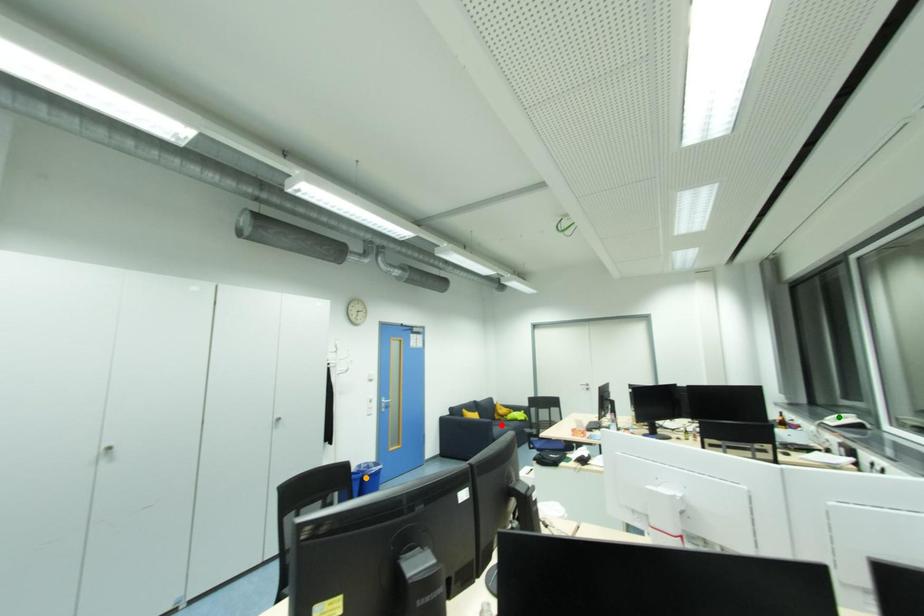
Order these from nearest to farthest:
A) red point
B) orange point
C) green point

green point < orange point < red point